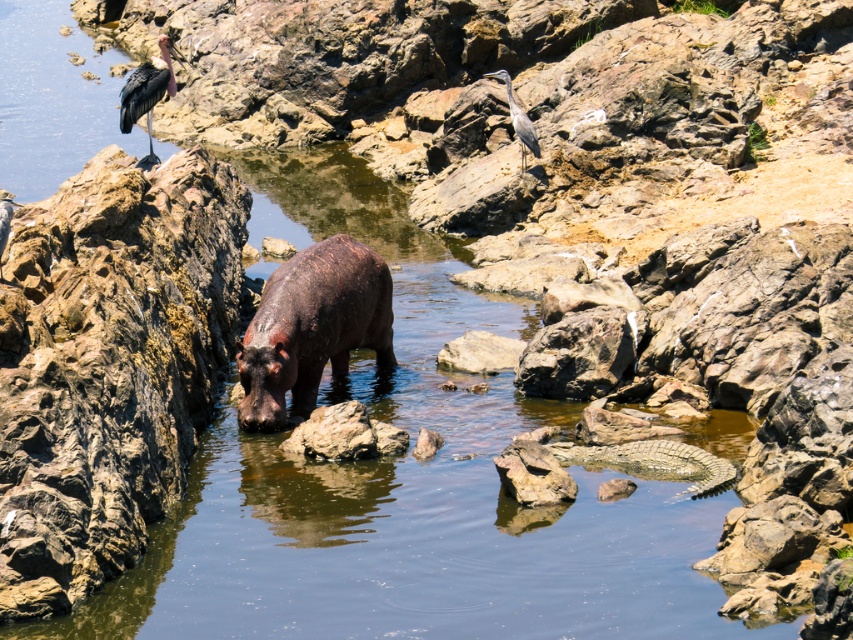
You are a wildlife photographer trying to capture a photo of the dark brown textured hippo at center and the gray matte heron at upper center in the same frame. Based on their distance, can you estimate if they will both fit in your camera viewfinder that has a 12 meter field of view?

The dark brown textured hippo at center and the gray matte heron at upper center are 10.35 meters apart. Since the distance between them is less than the 12 meter field of view of the camera, both subjects will fit within the viewfinder.